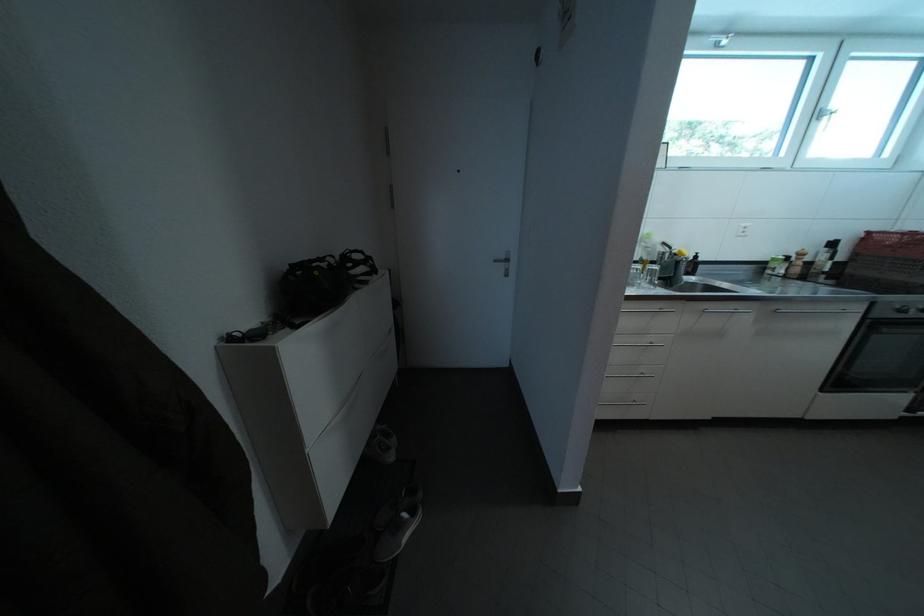
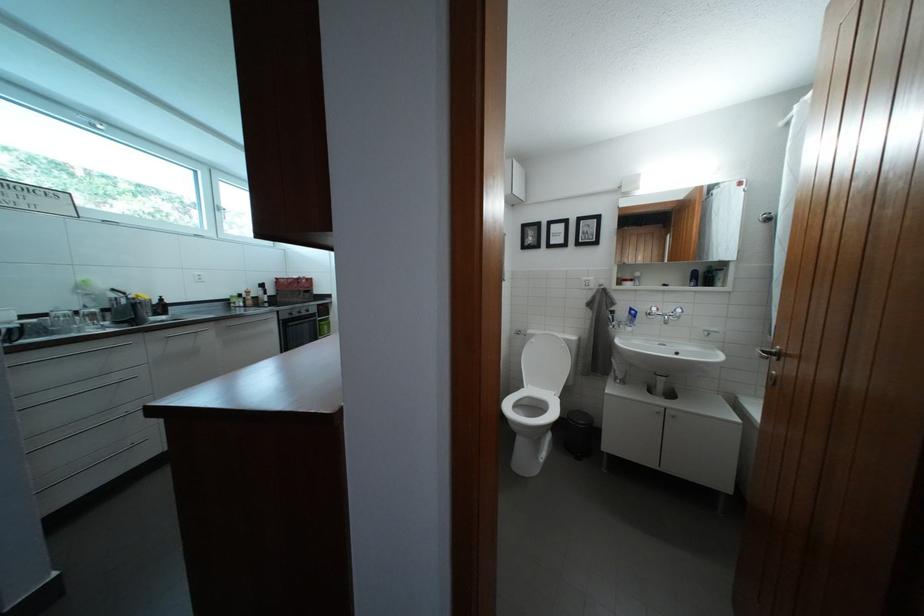
The point at (723, 46) is marked in the first image. Where is the corresponding point in the second image?

(94, 124)